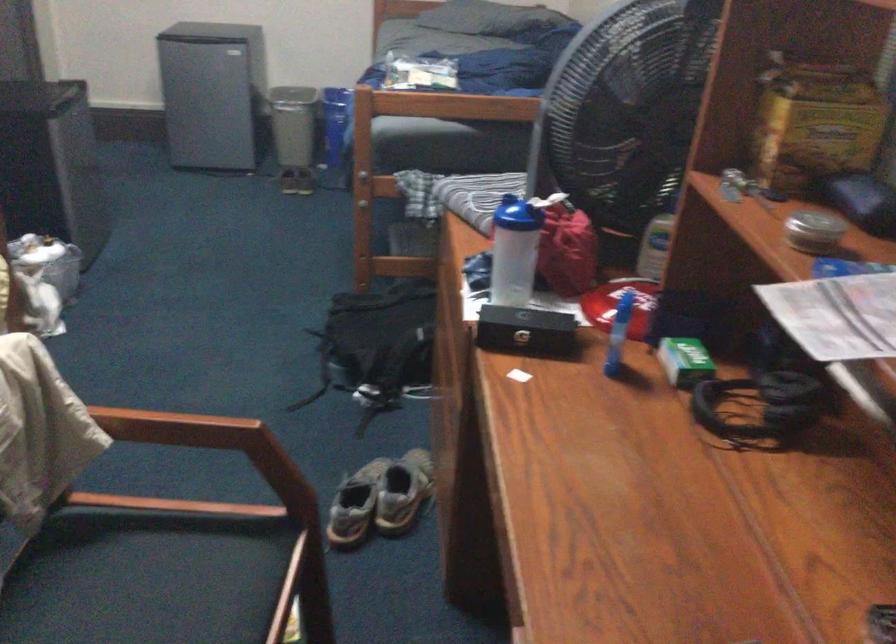
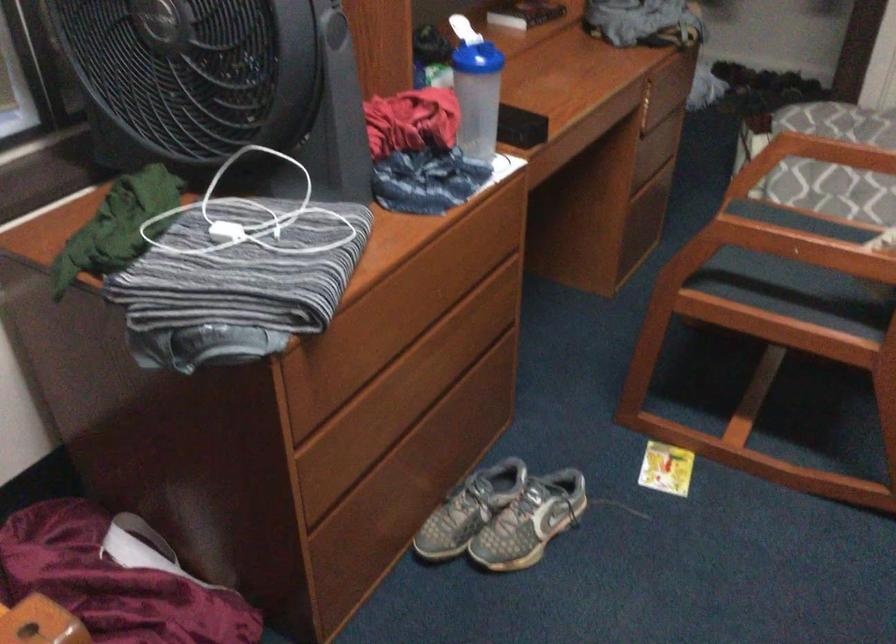
In the second image, find the point that corresponds to point (552, 210) in the first image.

(462, 29)